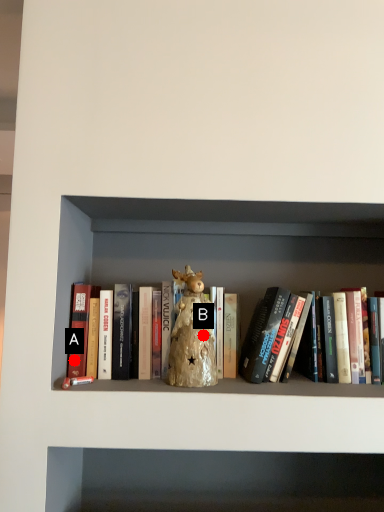
Question: Two points are circled on the image, labeled by A and B beside each circle. Which of the following is the farthest from the observer?

Choices:
 (A) A is further
 (B) B is further

Answer: (A)